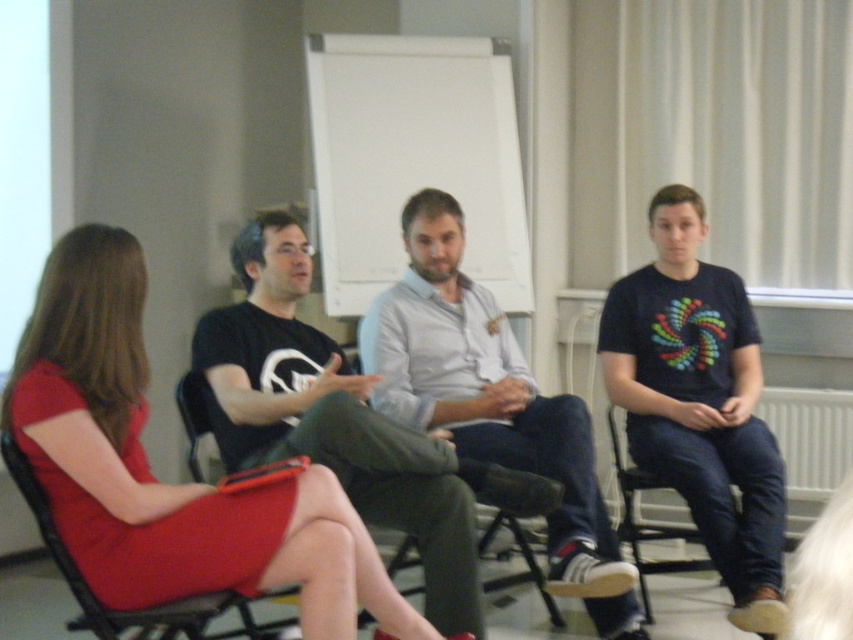
You are a photographer setting up for a group photo. You need to ensure that the matte red dress at center is visible above the black fabric chair at lower right in the final shot. Based on the scene description, can you confirm if this will be possible?

Yes, the matte red dress at center is taller than the black fabric chair at lower right, so it will be visible above it in the photo.

You are organizing a small event and need to know if the black cotton shirt at center and the velvet red armchair at left can fit side by side in a 2.5 meter wide space. Can they?

The black cotton shirt at center is wider than the velvet red armchair at left. However, since the combined width of both objects would depend on their individual measurements, but the problem does not provide specific widths. Therefore, it is impossible to determine if they can fit in the 2.5 meter space without additional information.

You are attending a meeting in the room and need to sit down. You see the matte red dress at center and the black fabric chair at lower right. Which object is closer to the floor?

The black fabric chair at lower right is closer to the floor because it is positioned below the matte red dress at center.